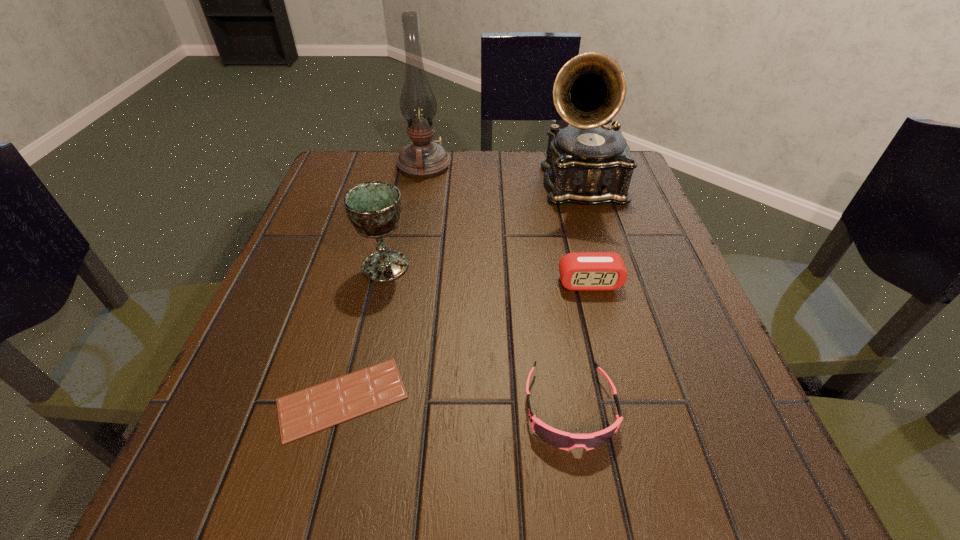
Find the location of a particular element. The height and width of the screenshot is (540, 960). oil lamp is located at coordinates (423, 158).

At what (x,y) coordinates should I click in order to perform the action: click on phonograph record. Please return your answer as a coordinate pair (x, y). The height and width of the screenshot is (540, 960). Looking at the image, I should click on (589, 163).

At what (x,y) coordinates should I click in order to perform the action: click on the third tallest object. Please return your answer as a coordinate pair (x, y). This screenshot has width=960, height=540. Looking at the image, I should click on (374, 208).

I want to click on the fourth tallest object, so click(x=581, y=270).

Find the location of a particular element. goggles is located at coordinates click(563, 440).

Identify the location of chocolate bar. The image size is (960, 540). (318, 407).

You are a GUI agent. You are given a task and a screenshot of the screen. Output one action in this format:
    pyautogui.click(x=<x>, y=<y>)
    Task: Click on the blank space located 0.050m on the front of the oil lamp
    The width and height of the screenshot is (960, 540).
    Given the screenshot: What is the action you would take?
    pyautogui.click(x=420, y=192)

Identify the location of vacant point located on the horn of the phonograph record. (617, 309).

Identify the location of vacant region located on the front of the fourth shortest object. This screenshot has height=540, width=960. (331, 504).

The height and width of the screenshot is (540, 960). What are the coordinates of `vacant region located on the front-facing side of the third shortest object` in the screenshot? It's located at [609, 357].